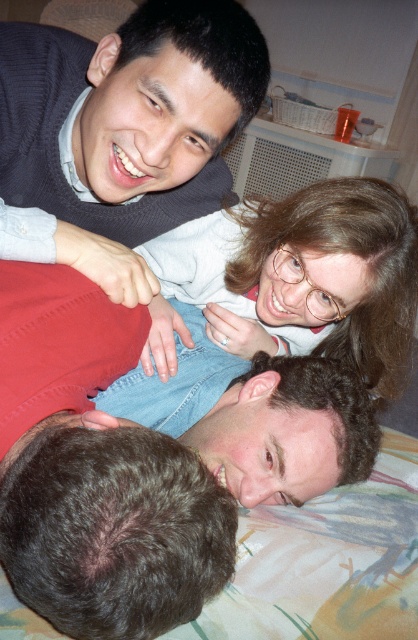
Based on the photo, you are a photographer standing at the foot of the bed. You want to take a photo of the person in the red garment and the matte blue jeans at upper center. How far apart are they from your perspective?

The person in the red garment and the matte blue jeans at upper center are 32.80 inches apart from your perspective.

You are a photographer standing 1 meter away from the camera. You want to take a photo of the dark brown hair at lower left. Can you reach it without moving the camera?

The dark brown hair at lower left and camera are 48.97 centimeters apart. Since you are standing 1 meter away from the camera, you can reach the dark brown hair at lower left without moving the camera because the distance between you and the camera is greater than the distance between the camera and the dark brown hair at lower left.